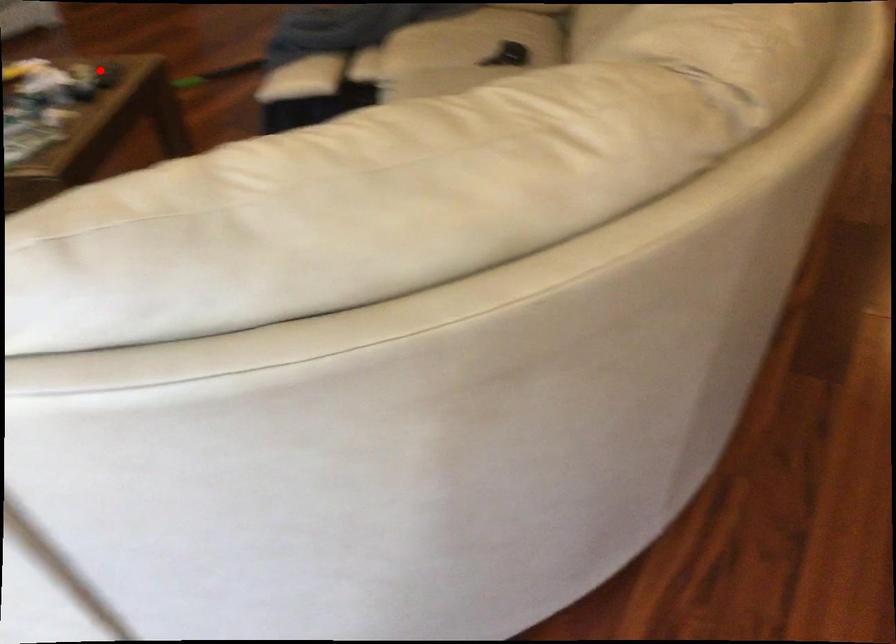
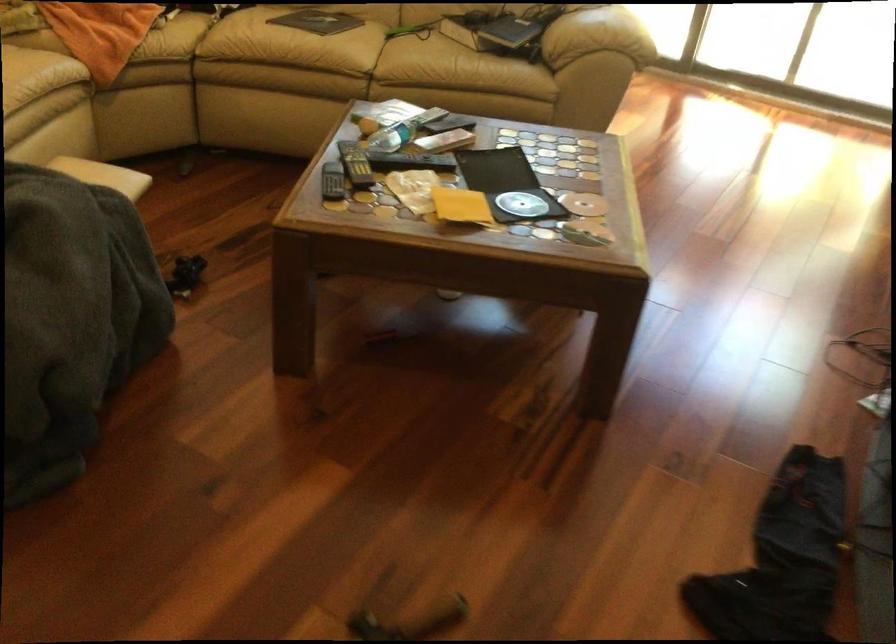
Question: I am providing you with two images of the same scene from different viewpoints. A red point is shown in image1. For the corresponding object point in image2, is it positioned nearer or farther from the camera?

Choices:
 (A) Nearer
 (B) Farther

Answer: (A)